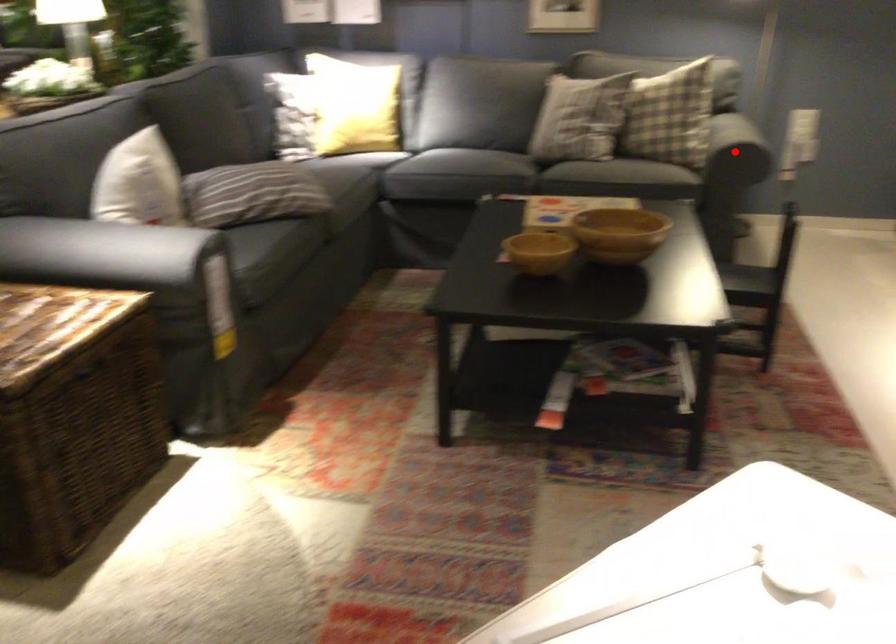
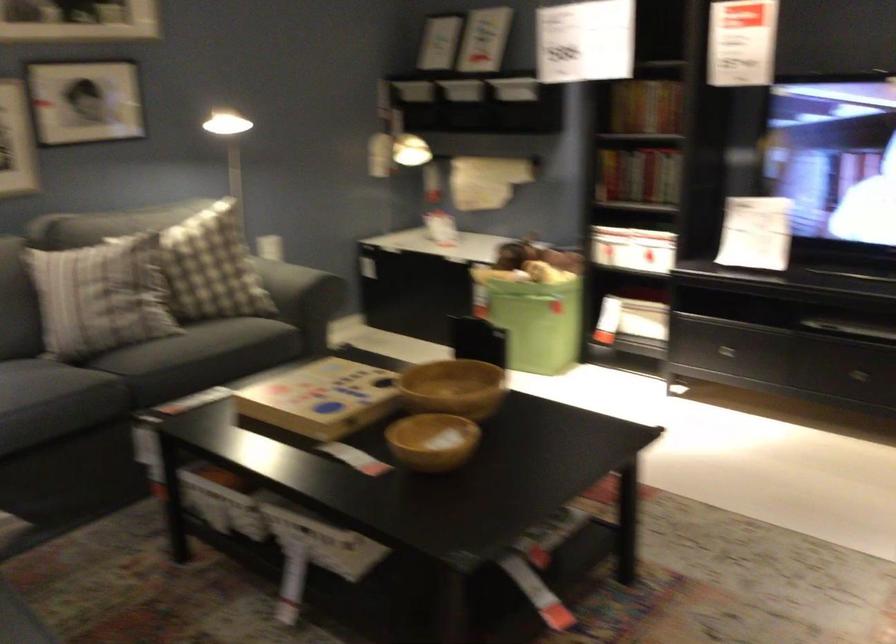
Question: I am providing you with two images of the same scene from different viewpoints. A red point is marked on the first image. Is the red point's position out of view in image 2?

Choices:
 (A) Yes
 (B) No

Answer: (A)